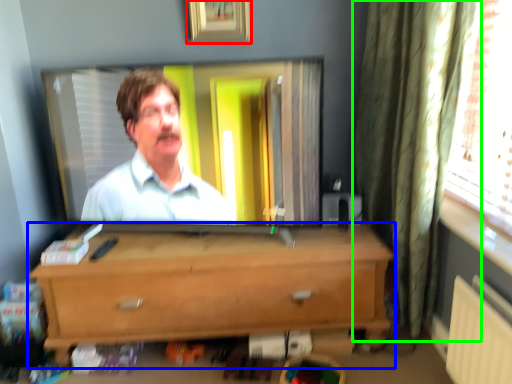
Question: Which object is positioned closest to picture frame (highlighted by a red box)? Select from chest of drawers (highlighted by a blue box) and curtain (highlighted by a green box).

Choices:
 (A) chest of drawers
 (B) curtain

Answer: (B)